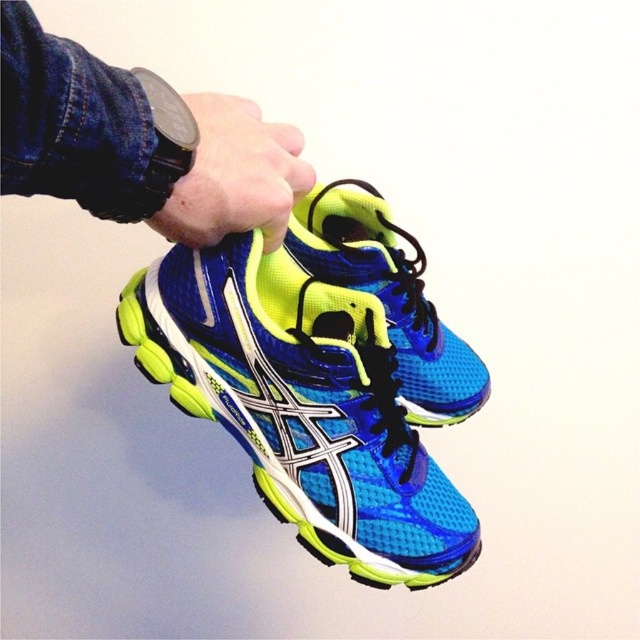
Between point (324, 557) and point (291, 140), which one is positioned in front?

Point (291, 140) is in front.

Can you confirm if blue mesh running shoe at center is taller than black watch at upper center?

Correct, blue mesh running shoe at center is much taller as black watch at upper center.

Between point (387, 400) and point (12, 122), which one is positioned in front?

Positioned in front is point (12, 122).

At what (x,y) coordinates should I click in order to perform the action: click on blue mesh running shoe at center. Please return your answer as a coordinate pair (x, y). Image resolution: width=640 pixels, height=640 pixels. Looking at the image, I should click on (301, 413).

Can you confirm if blue mesh running shoe at center is positioned to the left of black rubber wristwatch at upper center?

Incorrect, blue mesh running shoe at center is not on the left side of black rubber wristwatch at upper center.

Which of these two, blue mesh running shoe at center or black rubber wristwatch at upper center, stands taller?

blue mesh running shoe at center

Measure the distance between point (228, 253) and camera.

The distance of point (228, 253) from camera is 36.72 inches.

Locate an element on the screen. The image size is (640, 640). blue mesh running shoe at center is located at coordinates (301, 413).

Does point (184, 109) come closer to viewer compared to point (211, 179)?

Yes.

Who is more forward, (225, 221) or (241, 216)?

Point (241, 216)

Where is `black watch at upper center`? The image size is (640, 640). black watch at upper center is located at coordinates (140, 141).